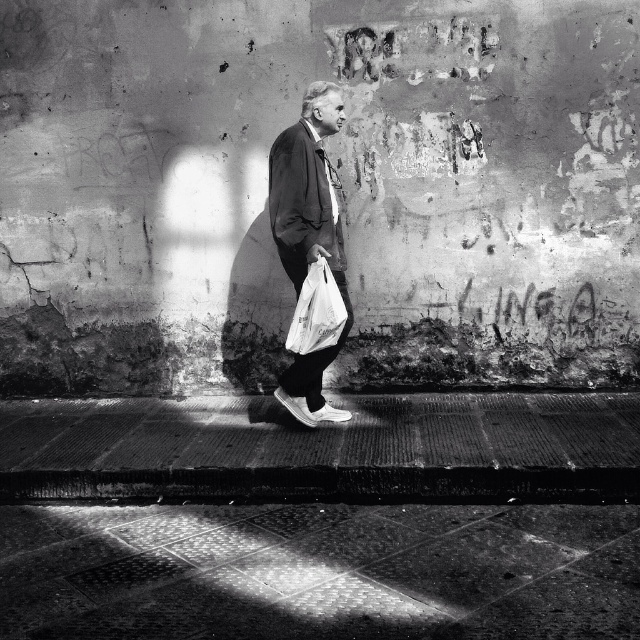
Can you confirm if matte black jacket at center is thinner than white plastic bag at lower center?

No.

What do you see at coordinates (308, 236) in the screenshot? The height and width of the screenshot is (640, 640). I see `matte black jacket at center` at bounding box center [308, 236].

Who is more forward, (x=269, y=209) or (x=328, y=296)?

Point (x=328, y=296) is more forward.

The image size is (640, 640). I want to click on matte black jacket at center, so click(x=308, y=236).

This screenshot has width=640, height=640. What do you see at coordinates (320, 572) in the screenshot?
I see `polished stone pavement at lower center` at bounding box center [320, 572].

Between polished stone pavement at lower center and matte black jacket at center, which one appears on the left side from the viewer's perspective?

polished stone pavement at lower center

Between point (33, 531) and point (288, 387), which one is positioned behind?

The point (288, 387) is more distant.

Find the location of a particular element. polished stone pavement at lower center is located at coordinates (320, 572).

Between polished stone pavement at lower center and white plastic bag at lower center, which one is positioned higher?

white plastic bag at lower center is above.

Measure the distance from polished stone pavement at lower center to white plastic bag at lower center.

1.30 meters

Which is behind, point (189, 509) or point (314, 342)?

The point (314, 342) is behind.

Where is `polished stone pavement at lower center`? polished stone pavement at lower center is located at coordinates (320, 572).